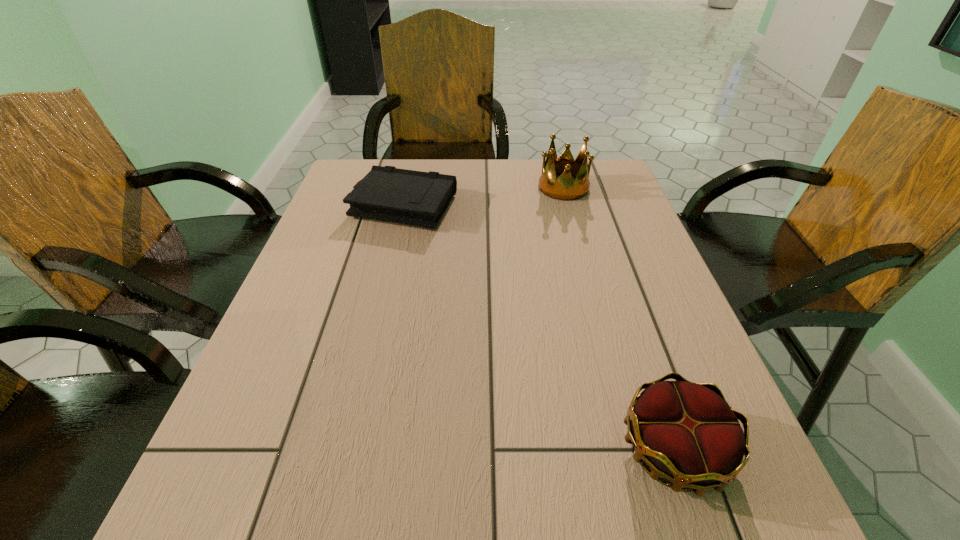
The image size is (960, 540). Find the location of `free region at the far left corner of the desktop`. free region at the far left corner of the desktop is located at coordinates coord(350,179).

You are a GUI agent. You are given a task and a screenshot of the screen. Output one action in this format:
    pyautogui.click(x=<x>, y=<y>)
    Task: Click on the free region at the near left corner of the desktop
    
    Given the screenshot: What is the action you would take?
    pyautogui.click(x=210, y=535)

Identify the location of free space at the near right corner. The width and height of the screenshot is (960, 540). (767, 495).

The image size is (960, 540). Find the location of `vacant point located between the taller crown and the nearest object`. vacant point located between the taller crown and the nearest object is located at coordinates (619, 318).

At what (x,y) coordinates should I click in order to perform the action: click on vacant point located between the Bible and the farther crown. Please return your answer as a coordinate pair (x, y). Looking at the image, I should click on (483, 197).

Find the location of a particular element. The image size is (960, 540). free space between the nearer crown and the Bible is located at coordinates (539, 327).

The image size is (960, 540). In order to click on vacant space that is in between the tallest object and the second tallest object in this screenshot , I will do `click(619, 318)`.

Identify the location of empty space that is in between the second tallest object and the Bible. The width and height of the screenshot is (960, 540). (539, 327).

This screenshot has width=960, height=540. In order to click on vacant area between the shortest object and the taller crown in this screenshot , I will do `click(483, 197)`.

Find the location of a particular element. free space between the shortest object and the farther crown is located at coordinates (483, 197).